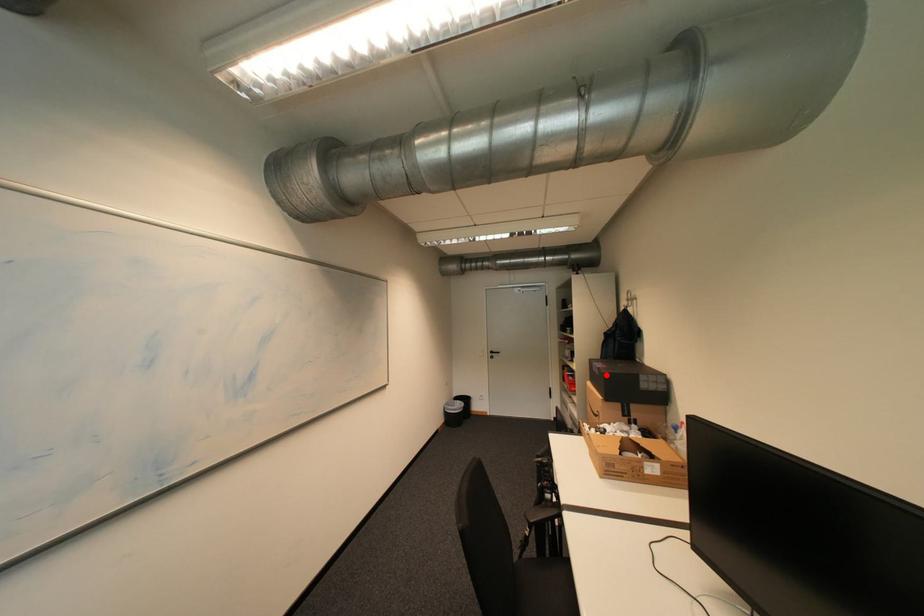
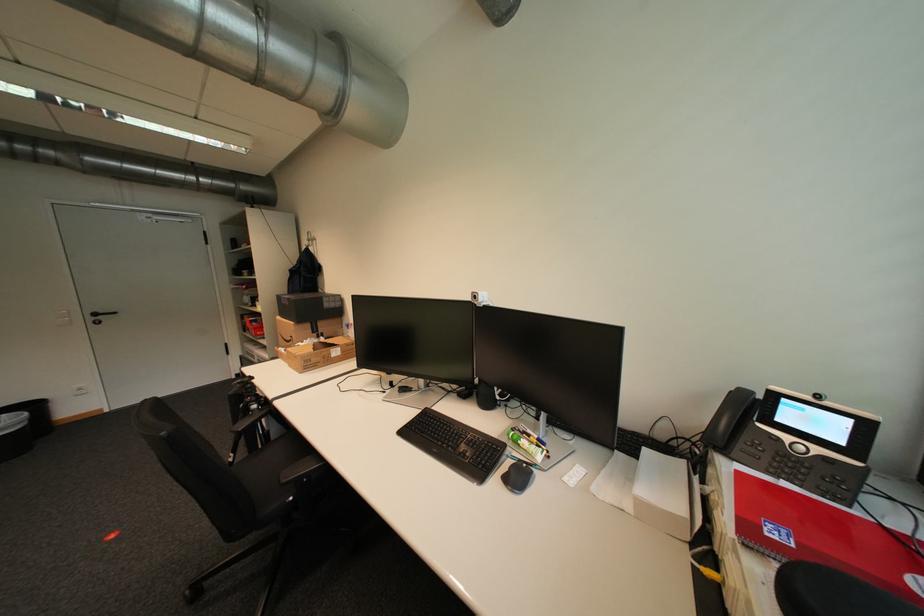
Locate, in the second image, the point that corresponds to the highlighted location in the first image.

(296, 305)